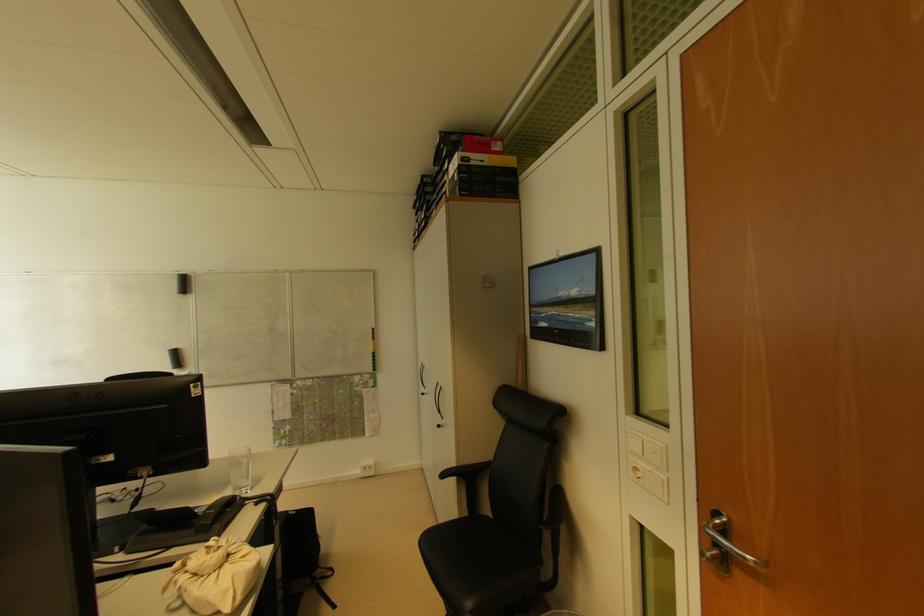
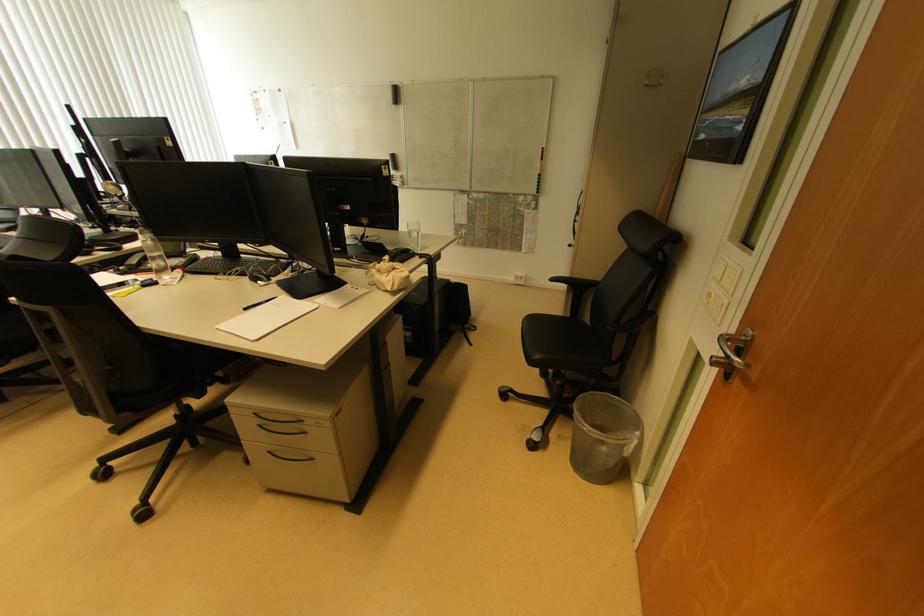
Locate, in the second image, the point that corresponds to (x=445, y=477) in the first image.

(555, 282)